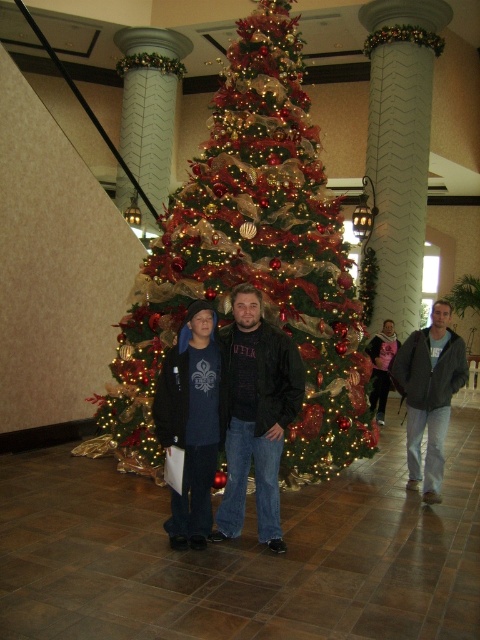
Question: Which of the following is the closest to the observer?

Choices:
 (A) gray cotton jacket at center
 (B) green textured christmas tree at center

Answer: (A)

Question: From the image, what is the correct spatial relationship of green textured christmas tree at center in relation to black matte jacket at center?

Choices:
 (A) left
 (B) right

Answer: (B)

Question: In this image, where is black matte jacket at center located relative to dark blue fleece jacket at center?

Choices:
 (A) above
 (B) below

Answer: (A)

Question: Which of the following is the farthest from the observer?

Choices:
 (A) (165, 392)
 (B) (447, 310)
 (C) (331, 330)

Answer: (C)

Question: Is dark blue fleece jacket at center positioned behind gray cotton jacket at center?

Choices:
 (A) no
 (B) yes

Answer: (A)

Question: Estimate the real-world distances between objects in this image. Which object is closer to the black matte jacket at center?

Choices:
 (A) green textured christmas tree at center
 (B) dark blue fleece jacket at center
 (C) gray cotton jacket at center

Answer: (B)